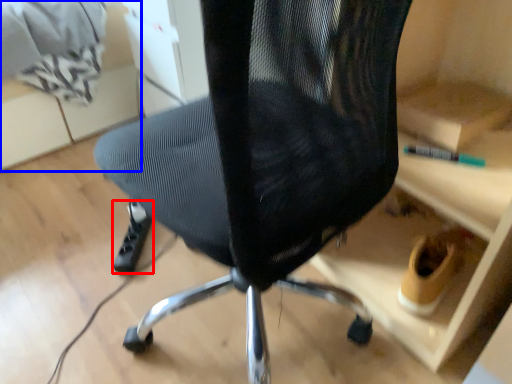
Question: Which object appears farthest to the camera in this image, foot (highlighted by a red box) or shelf (highlighted by a blue box)?

Choices:
 (A) foot
 (B) shelf

Answer: (B)